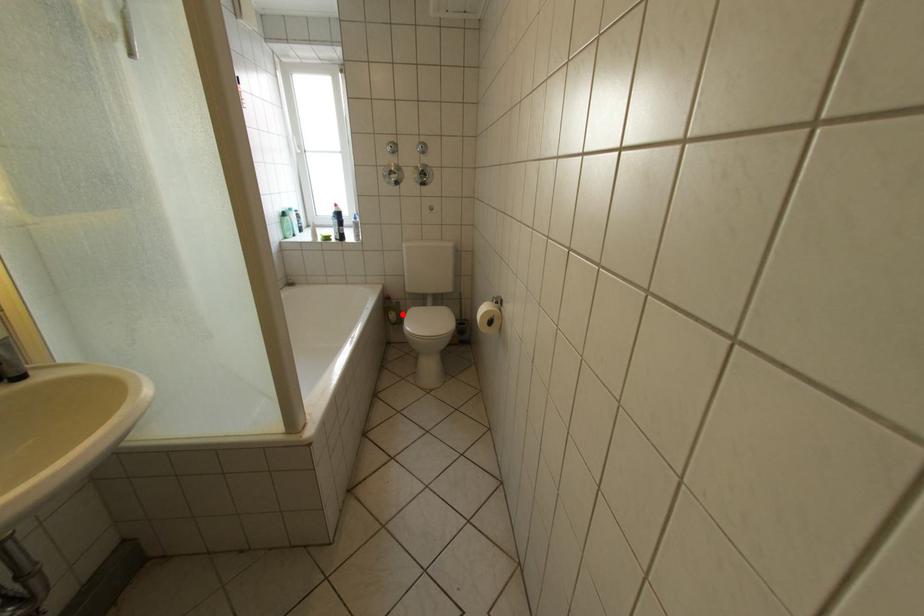
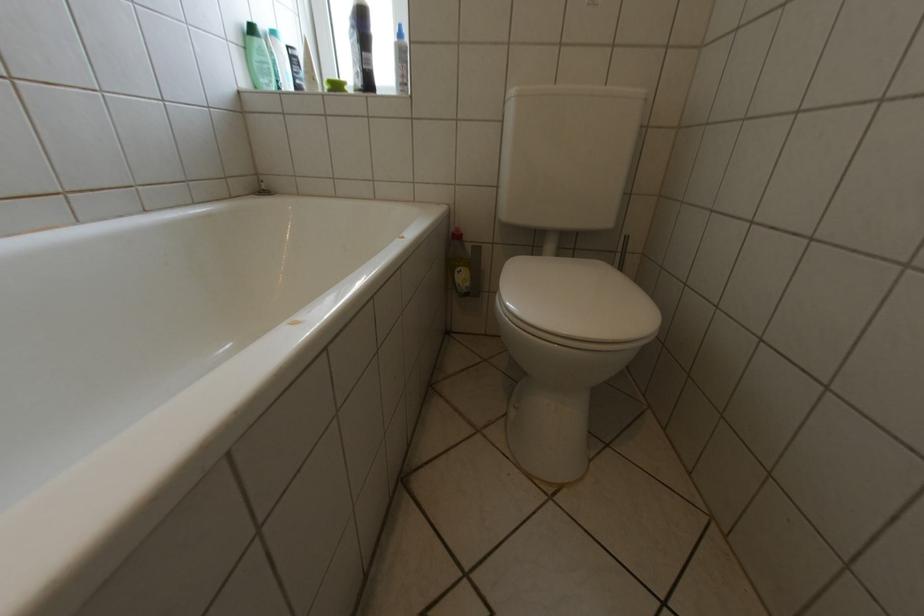
Question: I am providing you with two images of the same scene from different viewpoints. Given a red point in image1, look at the same physical point in image2. Is it:

Choices:
 (A) Closer to the viewpoint
 (B) Farther from the viewpoint

Answer: (A)